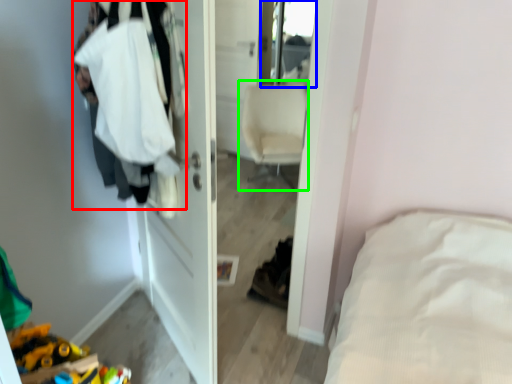
Question: Estimate the real-world distances between objects in this image. Which object is farther from clothing (highlighted by a red box), mirror (highlighted by a blue box) or chair (highlighted by a green box)?

Choices:
 (A) mirror
 (B) chair

Answer: (A)